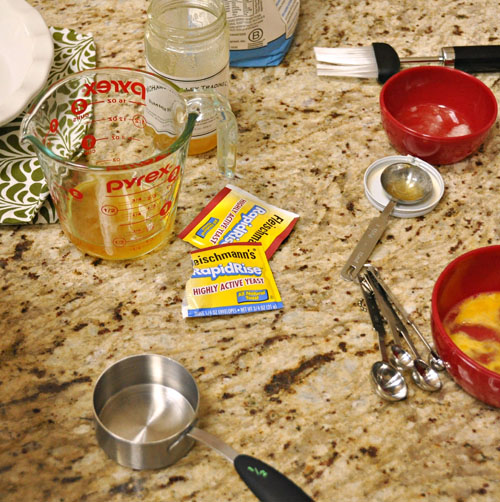
This screenshot has height=502, width=500. What are the coordinates of `jar` in the screenshot? It's located at (215, 58).